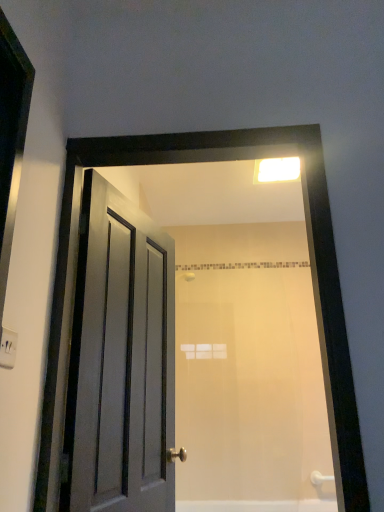
Question: Considering the relative sizes of matte gray door at left and white plastic light fixture at upper center in the image provided, is matte gray door at left smaller than white plastic light fixture at upper center?

Choices:
 (A) no
 (B) yes

Answer: (A)

Question: Does matte gray door at left lie behind white plastic light fixture at upper center?

Choices:
 (A) yes
 (B) no

Answer: (B)

Question: Is matte gray door at left positioned before white plastic light fixture at upper center?

Choices:
 (A) no
 (B) yes

Answer: (B)

Question: Is matte gray door at left turned away from white plastic light fixture at upper center?

Choices:
 (A) no
 (B) yes

Answer: (A)

Question: Can you confirm if matte gray door at left is taller than white plastic light fixture at upper center?

Choices:
 (A) yes
 (B) no

Answer: (A)

Question: Is matte gray door at left facing towards white plastic light fixture at upper center?

Choices:
 (A) yes
 (B) no

Answer: (B)

Question: Is white matte bathtub at lower center facing towards matte wooden door at center?

Choices:
 (A) no
 (B) yes

Answer: (A)

Question: Are white matte bathtub at lower center and matte wooden door at center far apart?

Choices:
 (A) no
 (B) yes

Answer: (B)

Question: Are white matte bathtub at lower center and matte wooden door at center making contact?

Choices:
 (A) no
 (B) yes

Answer: (A)

Question: From the image's perspective, is white matte bathtub at lower center located above matte wooden door at center?

Choices:
 (A) yes
 (B) no

Answer: (B)

Question: Would you say white matte bathtub at lower center is outside matte wooden door at center?

Choices:
 (A) yes
 (B) no

Answer: (A)

Question: From the image's perspective, is white matte bathtub at lower center under matte wooden door at center?

Choices:
 (A) yes
 (B) no

Answer: (A)

Question: Is white plastic light fixture at upper center turned away from matte wooden door at center?

Choices:
 (A) no
 (B) yes

Answer: (A)